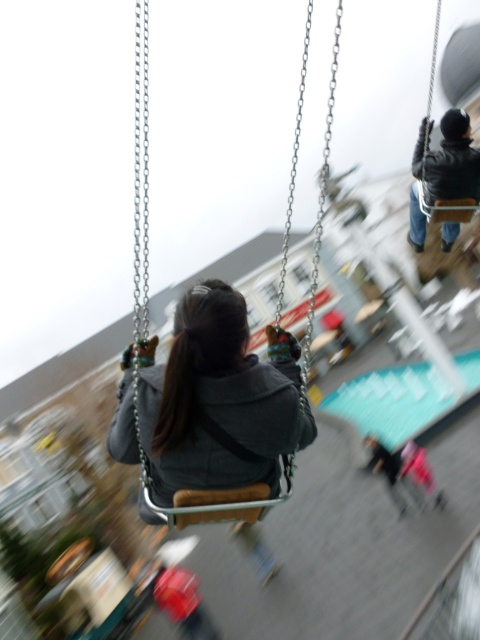
Does dark gray hoodie at center have a lesser height compared to dark gray jacket at upper right?

In fact, dark gray hoodie at center may be taller than dark gray jacket at upper right.

How distant is dark gray hoodie at center from dark gray jacket at upper right?

dark gray hoodie at center is 20.17 feet away from dark gray jacket at upper right.

I want to click on dark gray hoodie at center, so click(218, 397).

Find the location of `dark gray hoodie at center`. dark gray hoodie at center is located at coordinates (218, 397).

Does dark gray hoodie at center come behind wooden swing at center?

No.

Which is in front, point (225, 445) or point (336, 54)?

Positioned in front is point (225, 445).

Does point (168, 404) come closer to viewer compared to point (295, 132)?

Yes, it is.

I want to click on dark gray hoodie at center, so click(x=218, y=397).

Measure the distance between wooden swing at center and camera.

wooden swing at center is 3.34 meters away from camera.

Between wooden swing at center and dark gray jacket at upper right, which one appears on the right side from the viewer's perspective?

wooden swing at center

Who is more forward, (309,12) or (414,214)?

Point (309,12) is in front.

I want to click on wooden swing at center, so click(211, 492).